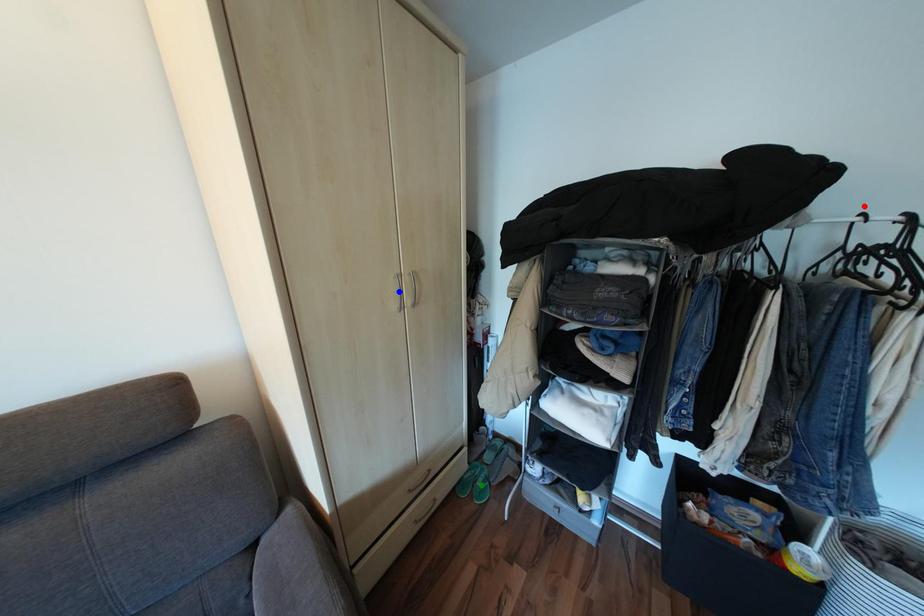
Based on the photo, order these from nearest to farthest:
- blue point
- green point
- red point

red point → blue point → green point